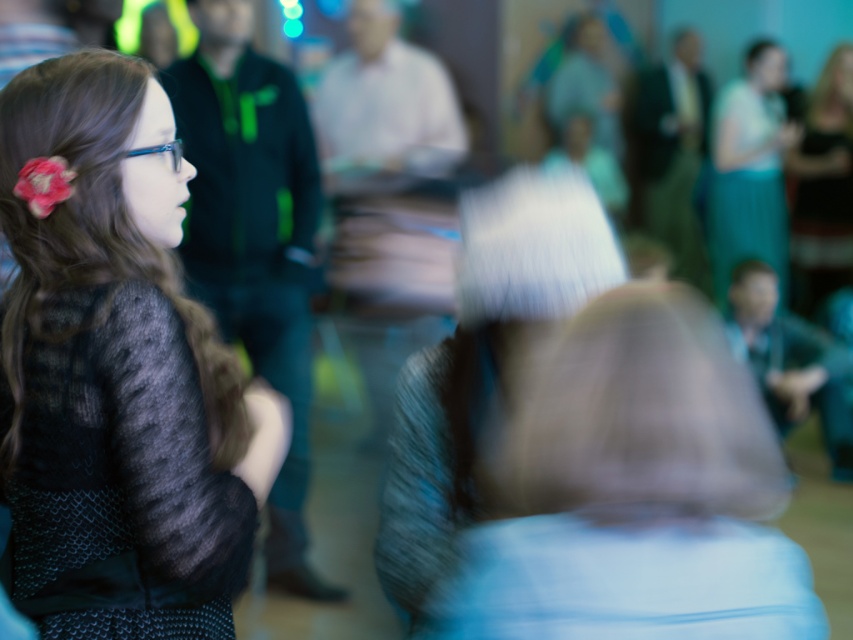
Question: Which point is closer to the camera taking this photo?

Choices:
 (A) (157, 176)
 (B) (717, 144)

Answer: (A)

Question: Is knitted sweater at left positioned before dark brown leather jacket at upper right?

Choices:
 (A) yes
 (B) no

Answer: (A)

Question: Is the position of teal fabric dress at upper right more distant than that of dark brown leather jacket at upper right?

Choices:
 (A) yes
 (B) no

Answer: (B)

Question: Which point is farther to the camera?

Choices:
 (A) (833, 136)
 (B) (165, 268)
 (C) (762, 240)

Answer: (A)

Question: In this image, where is knitted sweater at left located relative to teal fabric dress at upper right?

Choices:
 (A) above
 (B) below

Answer: (B)

Question: Based on their relative distances, which object is nearer to the teal fabric dress at upper right?

Choices:
 (A) dark brown leather jacket at upper right
 (B) knitted sweater at left

Answer: (A)